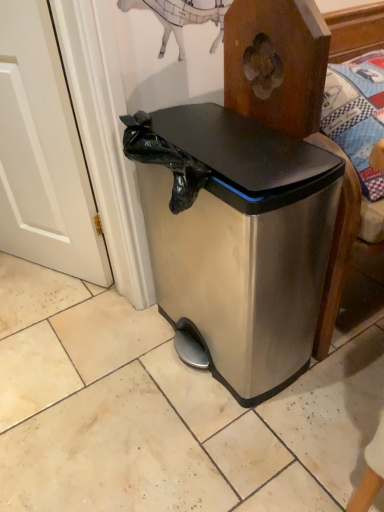
Question: From a real-world perspective, is white wood door at left positioned above or below stainless steel trash can at center?

Choices:
 (A) below
 (B) above

Answer: (B)

Question: Looking at the image, does white wood door at left seem bigger or smaller compared to stainless steel trash can at center?

Choices:
 (A) big
 (B) small

Answer: (B)

Question: Is white wood door at left spatially inside stainless steel trash can at center, or outside of it?

Choices:
 (A) inside
 (B) outside

Answer: (B)

Question: Which is correct: stainless steel trash can at center is inside white wood door at left, or outside of it?

Choices:
 (A) outside
 (B) inside

Answer: (A)

Question: From a real-world perspective, is stainless steel trash can at center above or below white wood door at left?

Choices:
 (A) above
 (B) below

Answer: (B)

Question: Relative to white wood door at left, is stainless steel trash can at center in front or behind?

Choices:
 (A) front
 (B) behind

Answer: (A)

Question: Would you say stainless steel trash can at center is to the left or to the right of white wood door at left in the picture?

Choices:
 (A) right
 (B) left

Answer: (A)